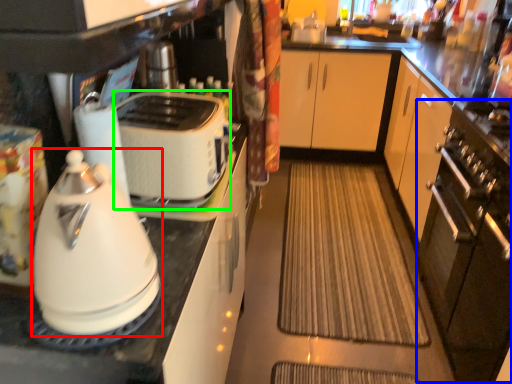
Question: Which is nearer to the kitchen appliance (highlighted by a red box)? oven (highlighted by a blue box) or toaster (highlighted by a green box).

Choices:
 (A) oven
 (B) toaster

Answer: (B)